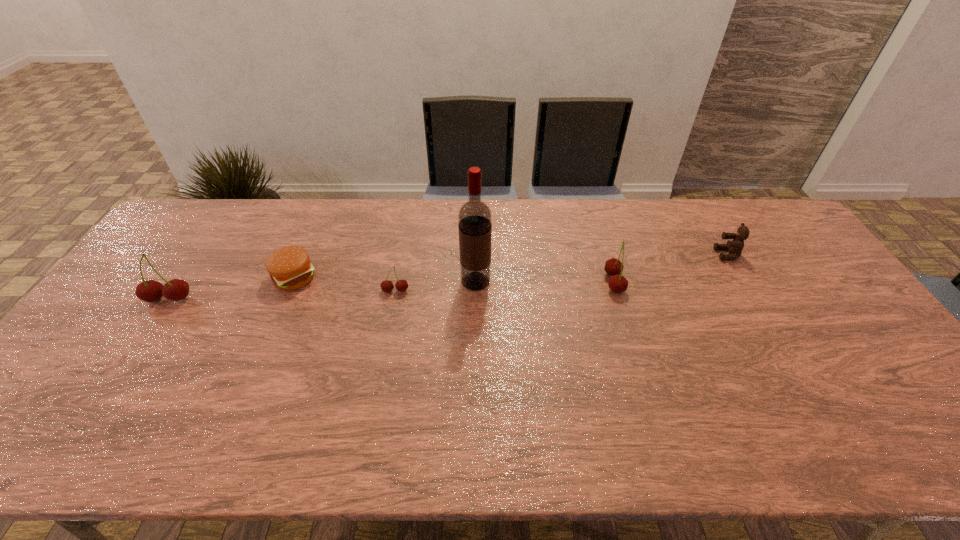
Locate an element on the screen. free space at the right edge is located at coordinates (832, 302).

The height and width of the screenshot is (540, 960). What are the coordinates of `vacant space at the near left corner of the desktop` in the screenshot? It's located at (92, 402).

Where is `free space at the near right corner of the desktop`? free space at the near right corner of the desktop is located at coordinates (856, 387).

Identify the location of vacant space that's between the rightmost object and the leftmost cherry. The width and height of the screenshot is (960, 540). (448, 276).

Where is `empty space that is in between the fourth object from right to left and the leftmost cherry`? empty space that is in between the fourth object from right to left and the leftmost cherry is located at coordinates (282, 295).

You are a GUI agent. You are given a task and a screenshot of the screen. Output one action in this format:
    pyautogui.click(x=<x>, y=<y>)
    Task: Click on the free space between the fourth object from left to right and the hamburger
    The image size is (960, 540).
    Given the screenshot: What is the action you would take?
    [x=385, y=280]

Where is `vacant area between the leftmost cherry and the third object from right to left`? The height and width of the screenshot is (540, 960). vacant area between the leftmost cherry and the third object from right to left is located at coordinates (323, 290).

Find the location of a particular element. free space between the rightmost cherry and the fourth object from right to left is located at coordinates (505, 287).

Image resolution: width=960 pixels, height=540 pixels. I want to click on free space between the third tallest object and the hamburger, so click(454, 280).

I want to click on vacant point located between the shortest cherry and the rightmost cherry, so click(505, 287).